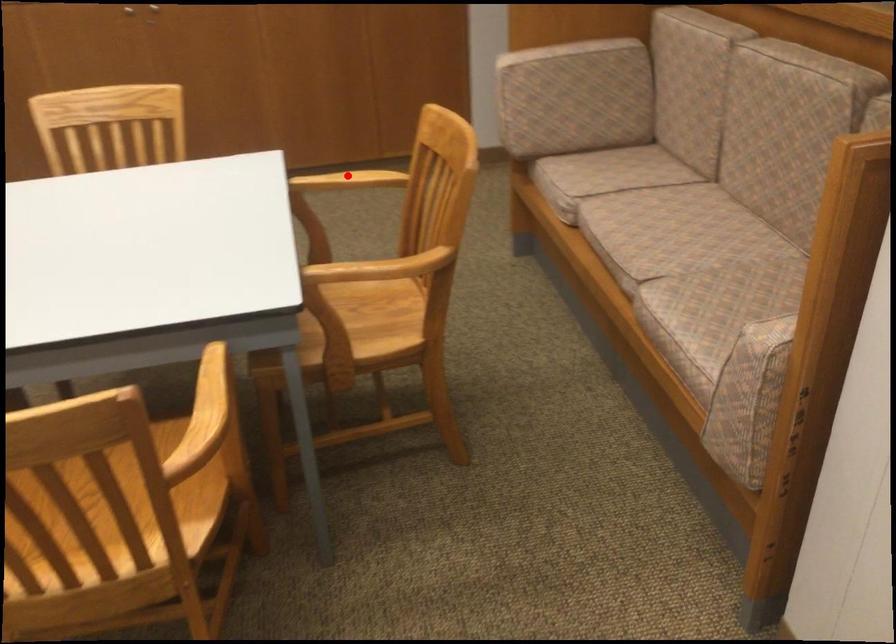
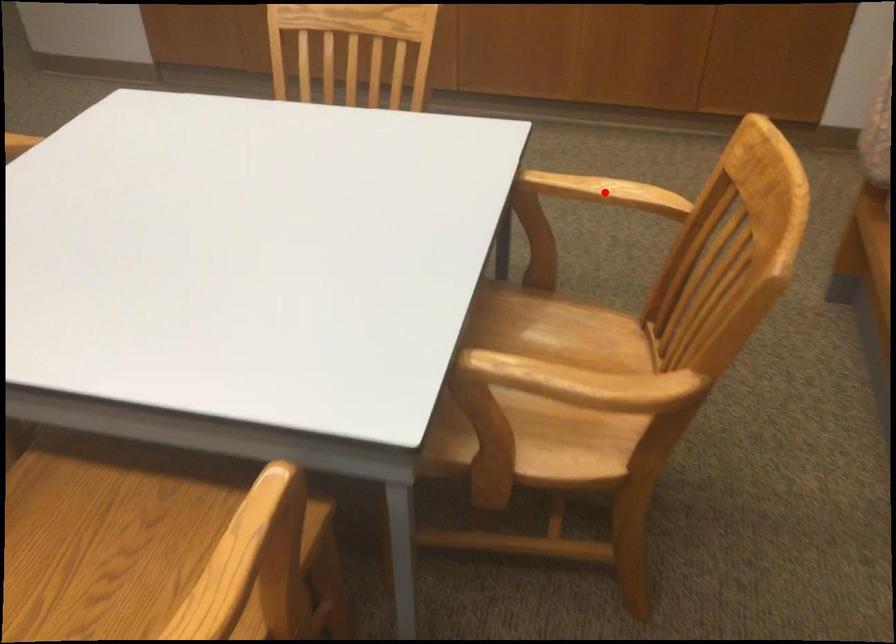
I am providing you with two images of the same scene from different viewpoints. A red point is marked on the first image and another point is marked on the second image. Is the red point in image1 aligned with the point shown in image2?

Yes